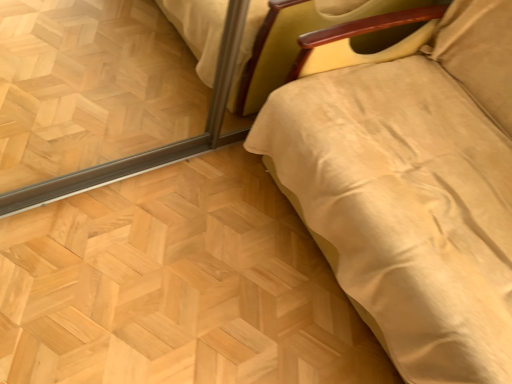
The image size is (512, 384). I want to click on beige fabric bed at right, so click(x=409, y=184).

The image size is (512, 384). Describe the element at coordinates (409, 184) in the screenshot. I see `beige fabric bed at right` at that location.

This screenshot has width=512, height=384. What do you see at coordinates (177, 286) in the screenshot? I see `natural wood floor at lower right` at bounding box center [177, 286].

You are a GUI agent. You are given a task and a screenshot of the screen. Output one action in this format:
    pyautogui.click(x=<x>, y=<y>)
    Task: Click on the natural wood floor at lower right
    The height and width of the screenshot is (384, 512).
    Given the screenshot: What is the action you would take?
    pyautogui.click(x=177, y=286)

This screenshot has height=384, width=512. Identify the location of beige fabric bed at right. (409, 184).

Which is more to the left, natural wood floor at lower right or beige fabric bed at right?

natural wood floor at lower right.

Which object is closer to the camera taking this photo, natural wood floor at lower right or beige fabric bed at right?

Positioned in front is beige fabric bed at right.

Between point (236, 376) and point (446, 33), which one is positioned in front?

The point (236, 376) is closer to the camera.

From the image's perspective, is natural wood floor at lower right above beige fabric bed at right?

No, from the image's perspective, natural wood floor at lower right is not above beige fabric bed at right.

From a real-world perspective, is natural wood floor at lower right located higher than beige fabric bed at right?

No, from a real-world perspective, natural wood floor at lower right is not above beige fabric bed at right.

Can you confirm if natural wood floor at lower right is thinner than beige fabric bed at right?

Indeed, natural wood floor at lower right has a lesser width compared to beige fabric bed at right.

In the scene shown: Considering the relative sizes of natural wood floor at lower right and beige fabric bed at right in the image provided, is natural wood floor at lower right shorter than beige fabric bed at right?

Correct, natural wood floor at lower right is not as tall as beige fabric bed at right.

Who is bigger, natural wood floor at lower right or beige fabric bed at right?

Bigger between the two is beige fabric bed at right.

Is natural wood floor at lower right completely or partially outside of beige fabric bed at right?

natural wood floor at lower right lies outside beige fabric bed at right's area.

Is natural wood floor at lower right touching beige fabric bed at right?

There is a gap between natural wood floor at lower right and beige fabric bed at right.

Is natural wood floor at lower right aimed at beige fabric bed at right?

No, natural wood floor at lower right is not aimed at beige fabric bed at right.

How much distance is there between natural wood floor at lower right and beige fabric bed at right?

18.85 inches.

Find the location of a particular element. plywood behind the beige fabric bed at right is located at coordinates (177, 286).

Between beige fabric bed at right and natural wood floor at lower right, which one appears on the left side from the viewer's perspective?

natural wood floor at lower right is more to the left.

Is beige fabric bed at right positioned in front of natural wood floor at lower right?

Yes, beige fabric bed at right is in front of natural wood floor at lower right.

Does point (369, 247) come closer to viewer compared to point (337, 322)?

Yes, it is.

From the image's perspective, between beige fabric bed at right and natural wood floor at lower right, which one is located above?

beige fabric bed at right appears higher in the image.

From a real-world perspective, which is physically above, beige fabric bed at right or natural wood floor at lower right?

beige fabric bed at right, from a real-world perspective.

Can you confirm if beige fabric bed at right is wider than natural wood floor at lower right?

Correct, the width of beige fabric bed at right exceeds that of natural wood floor at lower right.

Does beige fabric bed at right have a greater height compared to natural wood floor at lower right?

Indeed, beige fabric bed at right has a greater height compared to natural wood floor at lower right.

Is beige fabric bed at right bigger than natural wood floor at lower right?

Indeed, beige fabric bed at right has a larger size compared to natural wood floor at lower right.

Choose the correct answer: Is beige fabric bed at right inside natural wood floor at lower right or outside it?

beige fabric bed at right cannot be found inside natural wood floor at lower right.

Would you consider beige fabric bed at right to be distant from natural wood floor at lower right?

beige fabric bed at right is near natural wood floor at lower right, not far away.

Does beige fabric bed at right turn towards natural wood floor at lower right?

Yes, beige fabric bed at right faces towards natural wood floor at lower right.

Measure the distance from beige fabric bed at right to natural wood floor at lower right.

A distance of 18.85 inches exists between beige fabric bed at right and natural wood floor at lower right.

The height and width of the screenshot is (384, 512). In order to click on plywood directly beneath the beige fabric bed at right (from a real-world perspective) in this screenshot , I will do click(x=177, y=286).

I want to click on plywood below the beige fabric bed at right (from the image's perspective), so click(177, 286).

The height and width of the screenshot is (384, 512). I want to click on furniture that is on the right side of natural wood floor at lower right, so click(409, 184).